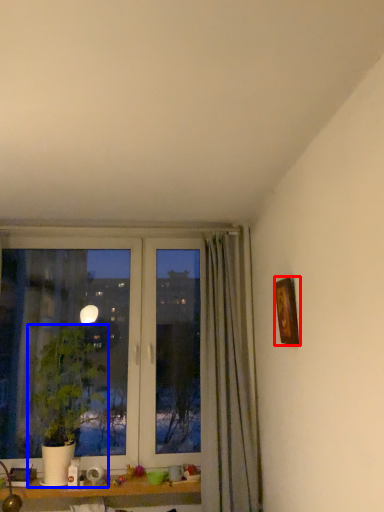
Question: Which object appears closest to the camera in this image, picture frame (highlighted by a red box) or houseplant (highlighted by a blue box)?

Choices:
 (A) picture frame
 (B) houseplant

Answer: (A)